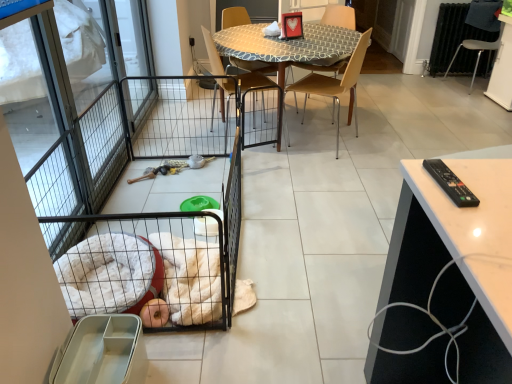
You are a GUI agent. You are given a task and a screenshot of the screen. Output one action in this format:
    pyautogui.click(x=<x>, y=<y>)
    Task: Click on the vacant space that is to the left of white glossy table at right
    
    Given the screenshot: What is the action you would take?
    pyautogui.click(x=345, y=284)